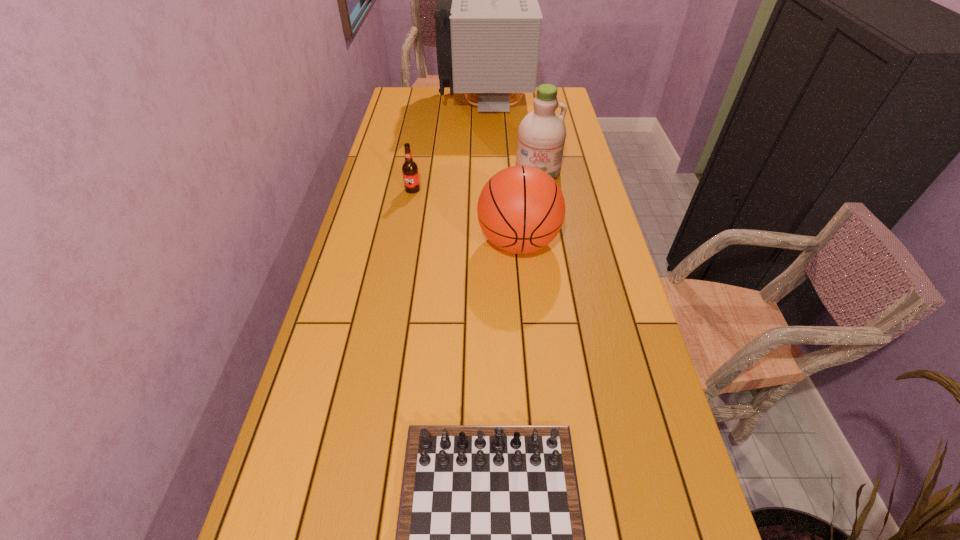
The height and width of the screenshot is (540, 960). Find the location of `vacant area situated on the front of the basketball`. vacant area situated on the front of the basketball is located at coordinates (522, 288).

Where is `vacant space situated 0.360m on the front of the second shortest object`? vacant space situated 0.360m on the front of the second shortest object is located at coordinates (398, 268).

Where is `object that is at the far edge`? The height and width of the screenshot is (540, 960). object that is at the far edge is located at coordinates (488, 21).

The image size is (960, 540). Find the location of `object present at the left edge`. object present at the left edge is located at coordinates (410, 173).

At what (x,y) coordinates should I click in order to perform the action: click on cleansing agent at the right edge. Please return your answer as a coordinate pair (x, y). The height and width of the screenshot is (540, 960). Looking at the image, I should click on (541, 135).

Find the location of `basketball present at the right edge`. basketball present at the right edge is located at coordinates (521, 209).

Where is `free location at the far edge`? free location at the far edge is located at coordinates pos(438,94).

In the image, there is a desktop. Identify the location of free space at the left edge. [375, 211].

You are a GUI agent. You are given a task and a screenshot of the screen. Output one action in this format:
    pyautogui.click(x=<x>, y=<y>)
    Task: Click on the free space at the right edge of the desktop
    The image size is (960, 540).
    Given the screenshot: What is the action you would take?
    pyautogui.click(x=633, y=455)

Where is `free space at the far left corner`? The height and width of the screenshot is (540, 960). free space at the far left corner is located at coordinates (414, 87).